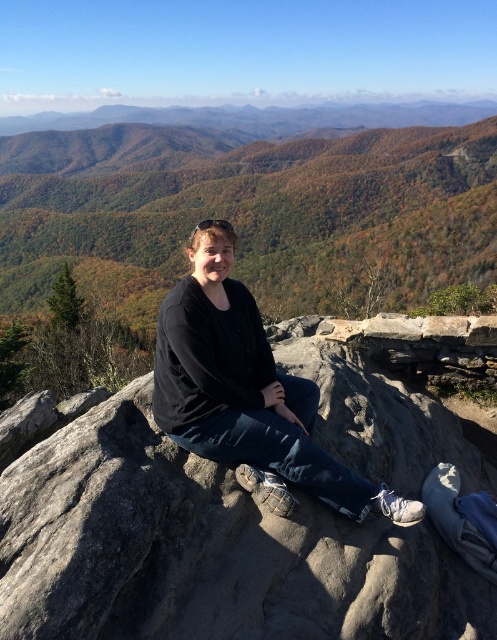
Question: Is gray rough rock at center closer to the viewer compared to black matte shirt at center?

Choices:
 (A) no
 (B) yes

Answer: (B)

Question: Is gray rough rock at center smaller than black matte shirt at center?

Choices:
 (A) no
 (B) yes

Answer: (B)

Question: Does gray rough rock at center appear under black matte shirt at center?

Choices:
 (A) yes
 (B) no

Answer: (A)

Question: Which point is closer to the camera?

Choices:
 (A) gray rough rock at center
 (B) black matte shirt at center

Answer: (A)

Question: Which object is farther from the camera taking this photo?

Choices:
 (A) gray rough rock at center
 (B) black matte shirt at center

Answer: (B)

Question: Which point is farther to the camera?

Choices:
 (A) (129, 515)
 (B) (193, 410)

Answer: (B)